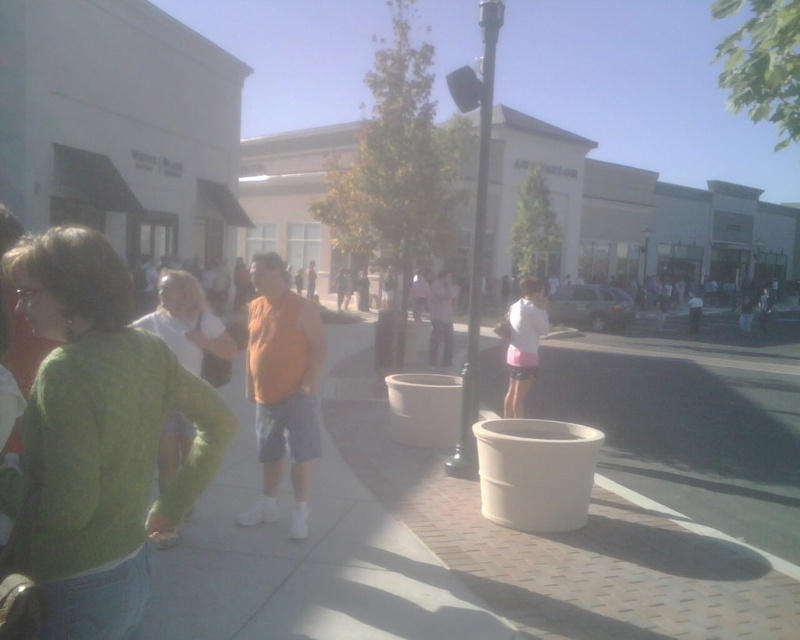
Does green knitted sweater at center have a lesser height compared to pink fabric shorts at center?

Indeed, green knitted sweater at center has a lesser height compared to pink fabric shorts at center.

Who is taller, green knitted sweater at center or pink fabric shorts at center?

Standing taller between the two is pink fabric shorts at center.

Consider the image. Who is more distant from viewer, (32, 400) or (528, 285)?

The point (528, 285) is behind.

The image size is (800, 640). Find the location of `green knitted sweater at center`. green knitted sweater at center is located at coordinates [100, 436].